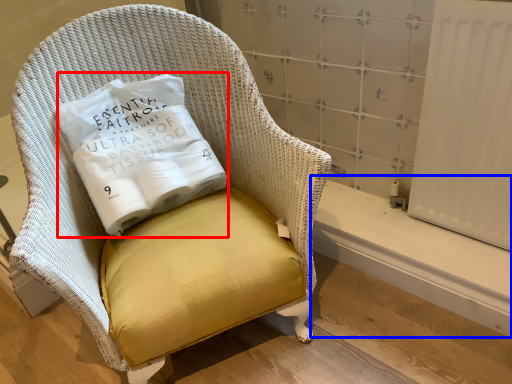
Question: Among these objects, which one is farthest to the camera, pillow (highlighted by a red box) or window sill (highlighted by a blue box)?

Choices:
 (A) pillow
 (B) window sill

Answer: (B)